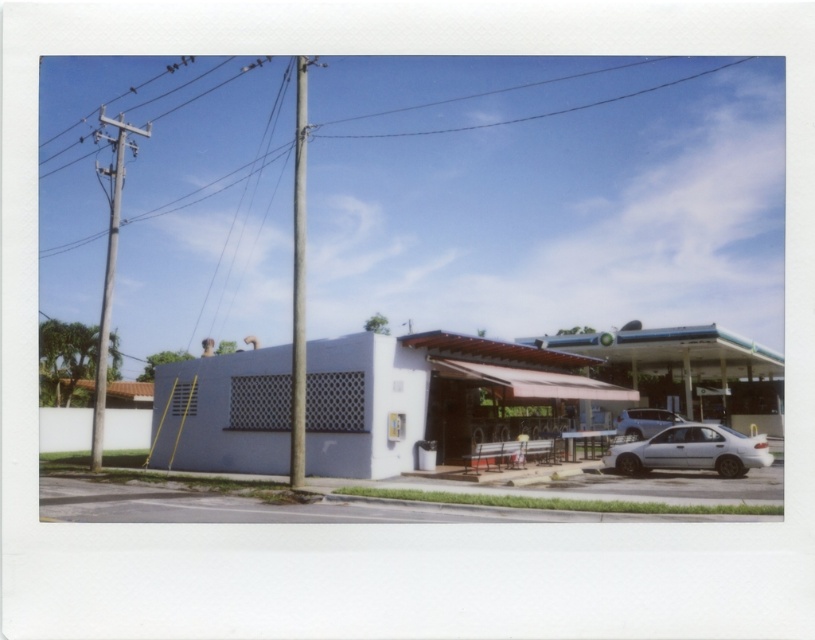
You are a pedestrian standing on the sidewalk in front of the building. You notice the gray concrete utility pole at left and the silver metallic car at right. Which object is closer to the building?

The gray concrete utility pole at left is closer to the building because it is positioned over the silver metallic car at right, indicating it is in front of the car and thus nearer to the building.

You are a delivery person trying to park your silver metallic car at right near the building. You notice a clear wire at upper center above the parking spot. Is there enough space for the car to park without hitting the wire?

The clear wire at upper center might be wider than the silver metallic car at right, so there is a possibility that the car could hit the wire if it is wider. Check the width before parking.